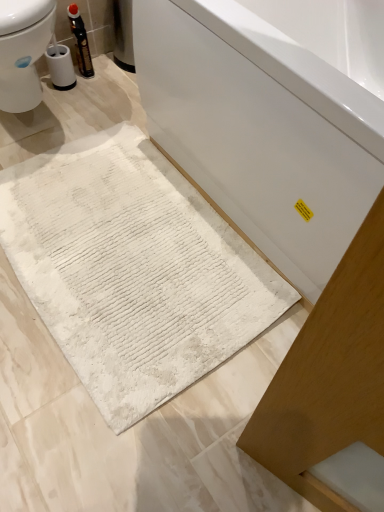
Question: Considering the relative sizes of white textured bath mat at lower center and white glossy bathtub at center in the image provided, is white textured bath mat at lower center taller than white glossy bathtub at center?

Choices:
 (A) no
 (B) yes

Answer: (A)

Question: Is white textured bath mat at lower center next to white glossy bathtub at center and touching it?

Choices:
 (A) yes
 (B) no

Answer: (B)

Question: Considering the relative sizes of white textured bath mat at lower center and white glossy bathtub at center in the image provided, is white textured bath mat at lower center wider than white glossy bathtub at center?

Choices:
 (A) no
 (B) yes

Answer: (A)

Question: From a real-world perspective, is white textured bath mat at lower center physically above white glossy bathtub at center?

Choices:
 (A) no
 (B) yes

Answer: (A)

Question: Is white textured bath mat at lower center thinner than white glossy bathtub at center?

Choices:
 (A) yes
 (B) no

Answer: (A)

Question: Considering the positions of point (347, 47) and point (221, 252), is point (347, 47) closer or farther from the camera than point (221, 252)?

Choices:
 (A) closer
 (B) farther

Answer: (B)

Question: In the image, is white glossy bathtub at center positioned in front of or behind white textured bath mat at lower center?

Choices:
 (A) front
 (B) behind

Answer: (A)

Question: Choose the correct answer: Is white glossy bathtub at center inside white textured bath mat at lower center or outside it?

Choices:
 (A) inside
 (B) outside

Answer: (B)

Question: Based on their sizes in the image, would you say white glossy bathtub at center is bigger or smaller than white textured bath mat at lower center?

Choices:
 (A) small
 (B) big

Answer: (B)

Question: From the image's perspective, relative to white textured bath mat at lower center, is matte black bottle at upper left above or below?

Choices:
 (A) below
 (B) above

Answer: (B)

Question: Does point (72, 31) appear closer or farther from the camera than point (124, 378)?

Choices:
 (A) farther
 (B) closer

Answer: (A)

Question: Is matte black bottle at upper left situated inside white textured bath mat at lower center or outside?

Choices:
 (A) inside
 (B) outside

Answer: (B)

Question: Considering the positions of matte black bottle at upper left and white textured bath mat at lower center in the image, is matte black bottle at upper left wider or thinner than white textured bath mat at lower center?

Choices:
 (A) wide
 (B) thin

Answer: (B)

Question: Looking at their shapes, would you say white textured bath mat at lower center is wider or thinner than matte black bottle at upper left?

Choices:
 (A) thin
 (B) wide

Answer: (B)

Question: From the image's perspective, relative to matte black bottle at upper left, is white textured bath mat at lower center above or below?

Choices:
 (A) above
 (B) below

Answer: (B)